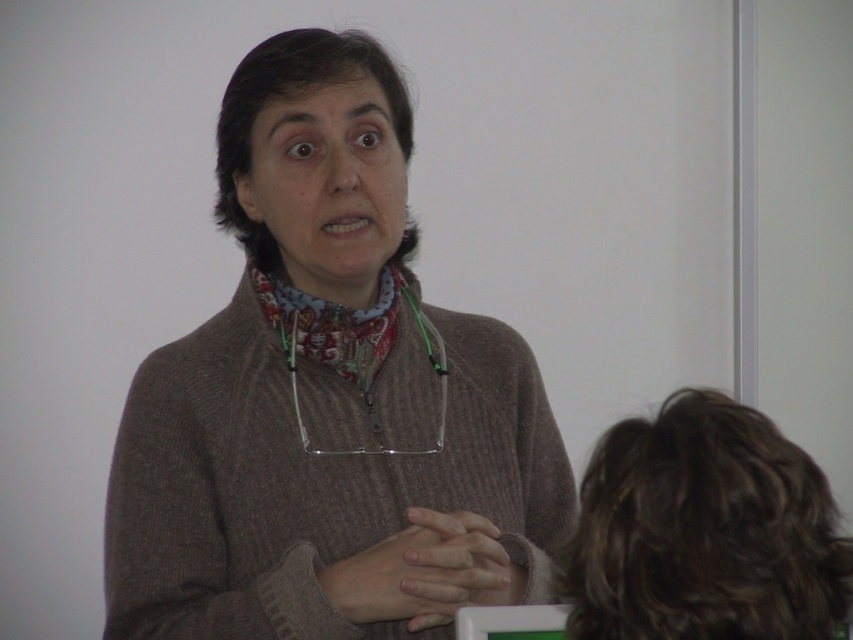
Question: Estimate the real-world distances between objects in this image. Which object is farther from the dark brown hair at lower right?

Choices:
 (A) brown knitted sweater at center
 (B) patterned fabric at center

Answer: (B)

Question: Does brown knitted sweater at center have a greater width compared to smooth skin hands at center?

Choices:
 (A) yes
 (B) no

Answer: (A)

Question: Does dark brown hair at lower right have a greater width compared to smooth skin hands at center?

Choices:
 (A) no
 (B) yes

Answer: (B)

Question: Among these objects, which one is nearest to the camera?

Choices:
 (A) smooth skin hands at center
 (B) patterned fabric at center
 (C) dark brown hair at lower right
 (D) brown knitted sweater at center

Answer: (C)

Question: Can you confirm if brown knitted sweater at center is bigger than printed fabric neckband at center?

Choices:
 (A) yes
 (B) no

Answer: (A)

Question: Which object is farther from the camera taking this photo?

Choices:
 (A) patterned fabric at center
 (B) dark brown hair at lower right

Answer: (A)